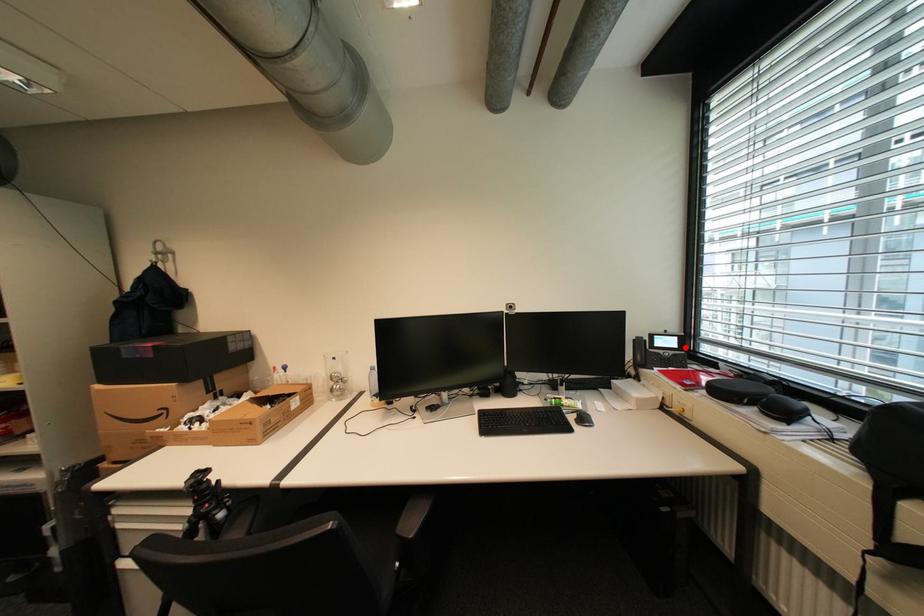
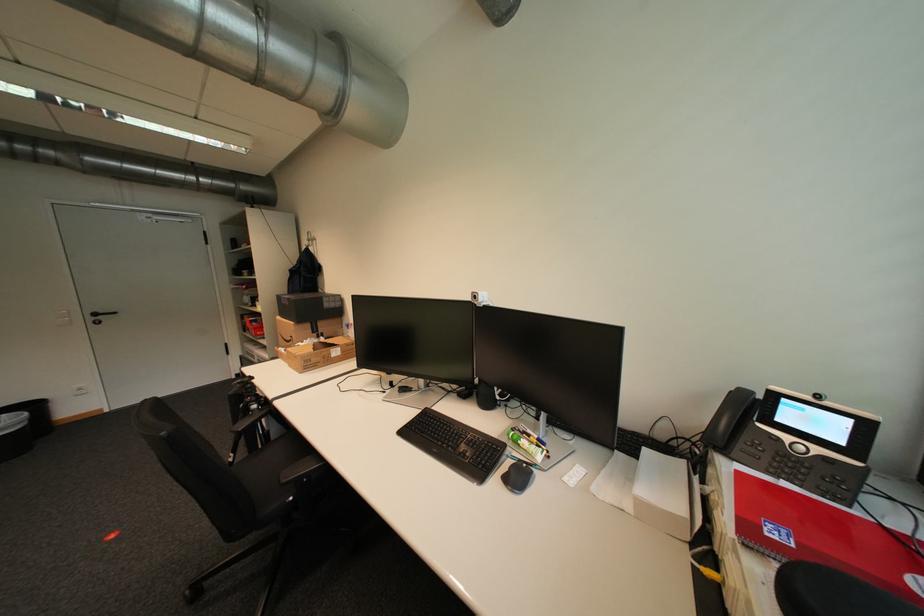
Question: I am providing you with two images of the same scene from different viewpoints. A red point is shown in image1. For the corresponding object point in image2, is it positioned nearer or farther from the camera?

Choices:
 (A) Nearer
 (B) Farther

Answer: (A)